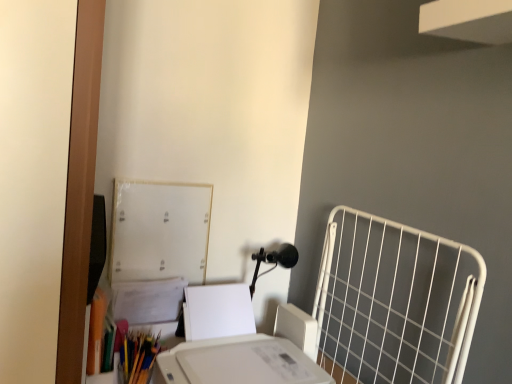
This screenshot has height=384, width=512. What do you see at coordinates (138, 356) in the screenshot?
I see `matte wooden crayon at lower left` at bounding box center [138, 356].

I want to click on matte wooden crayon at lower left, so click(138, 356).

What is the approximate height of matte wooden crayon at lower left?

matte wooden crayon at lower left is 6.67 inches in height.

Image resolution: width=512 pixels, height=384 pixels. I want to click on matte wooden crayon at lower left, so click(138, 356).